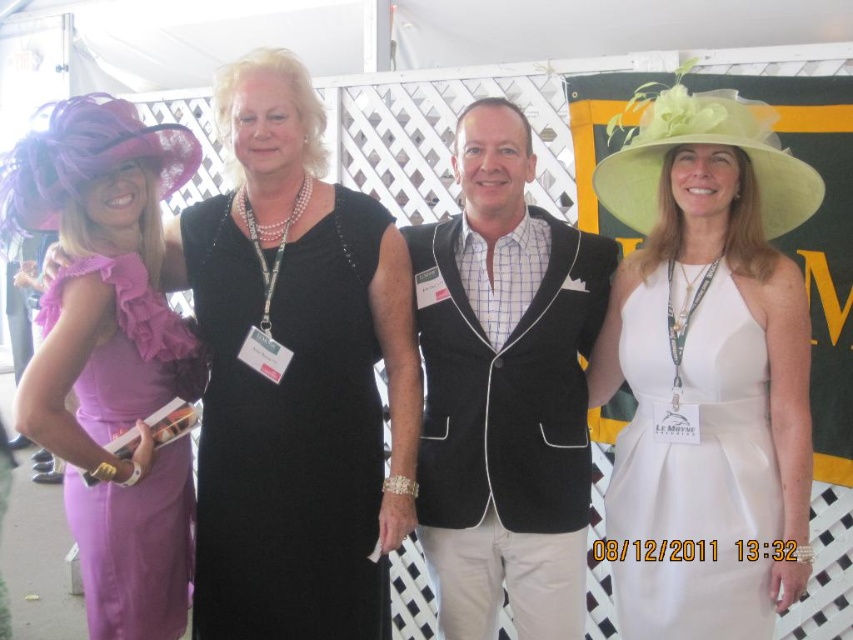
Question: Can you confirm if white satin dress at center is smaller than ruffled satin dress at left?

Choices:
 (A) yes
 (B) no

Answer: (A)

Question: Among these points, which one is nearest to the camera?

Choices:
 (A) (724, 298)
 (B) (163, 397)

Answer: (A)

Question: Which object is positioned farthest from the black corduroy vest at center?

Choices:
 (A) white satin dress at center
 (B) black satin dress at center
 (C) ruffled satin dress at left
 (D) matte purple dress at left

Answer: (C)

Question: In this image, where is black satin dress at center located relative to ruffled satin dress at left?

Choices:
 (A) left
 (B) right

Answer: (B)

Question: Considering the real-world distances, which object is closest to the ruffled satin dress at left?

Choices:
 (A) matte purple dress at left
 (B) black corduroy vest at center
 (C) white satin dress at center
 (D) black satin dress at center

Answer: (D)

Question: Does matte purple dress at left appear on the left side of white satin dress at center?

Choices:
 (A) yes
 (B) no

Answer: (A)